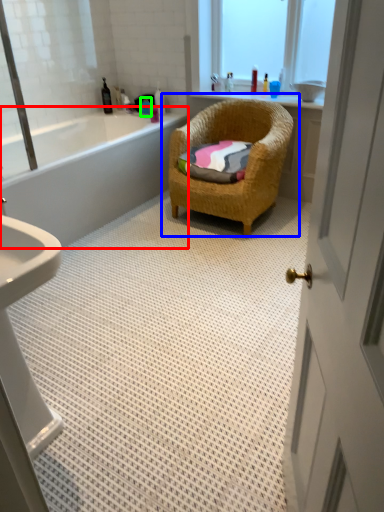
Question: Based on their relative distances, which object is farther from bathtub (highlighted by a red box)? Choose from chair (highlighted by a blue box) and toiletry (highlighted by a green box).

Choices:
 (A) chair
 (B) toiletry

Answer: (B)